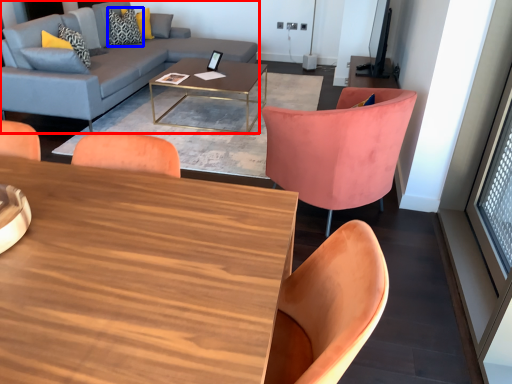
Question: Which of the following is the farthest to the observer, studio couch (highlighted by a red box) or pillow (highlighted by a blue box)?

Choices:
 (A) studio couch
 (B) pillow

Answer: (B)